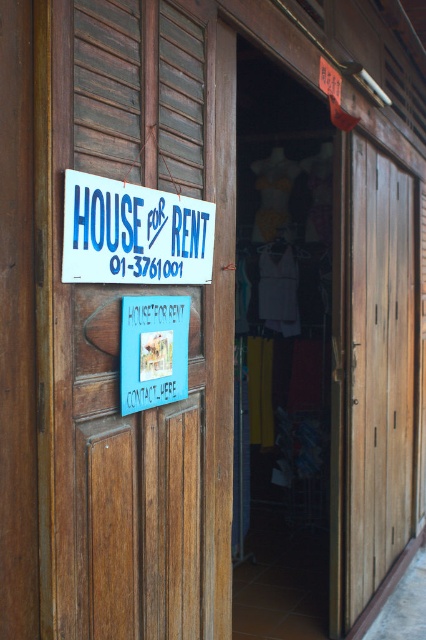
Based on the photo, you are standing in front of the wooden building entrance. There is a point marked at coordinates (118, 328). What object does this point correspond to?

The point corresponds to the wooden door at left.